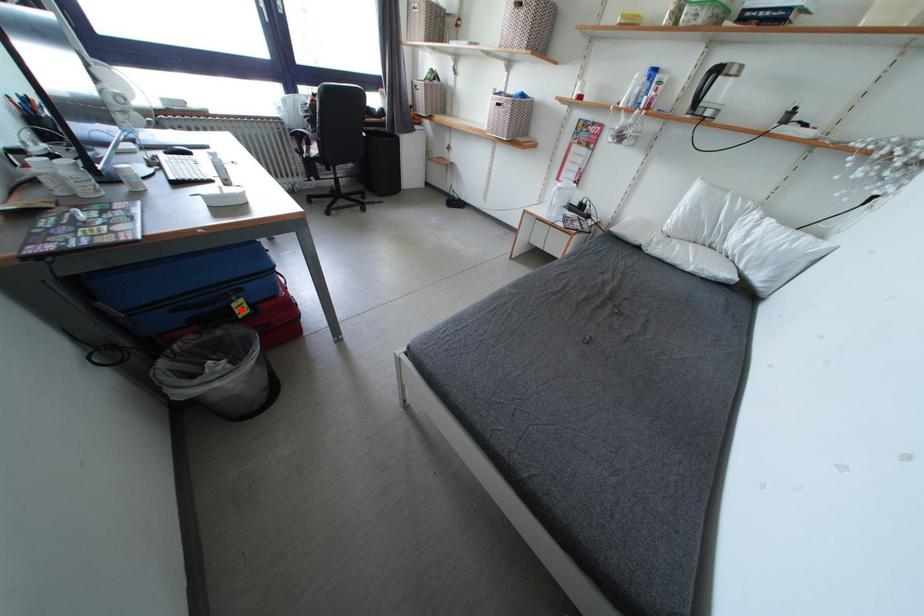
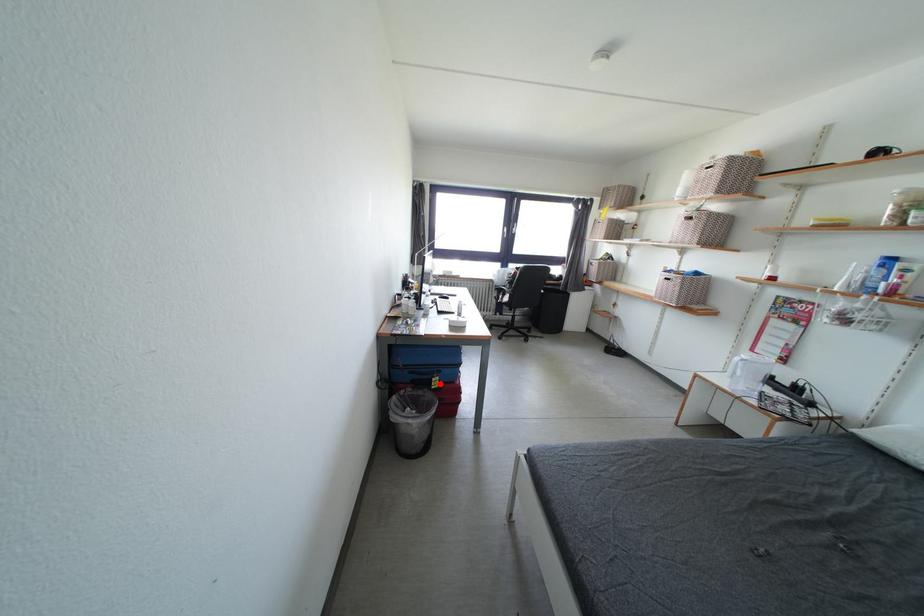
I am providing you with two images of the same scene from different viewpoints. A red point is marked on the first image and another point is marked on the second image. Is the marked point in image1 the same physical position as the marked point in image2?

Yes